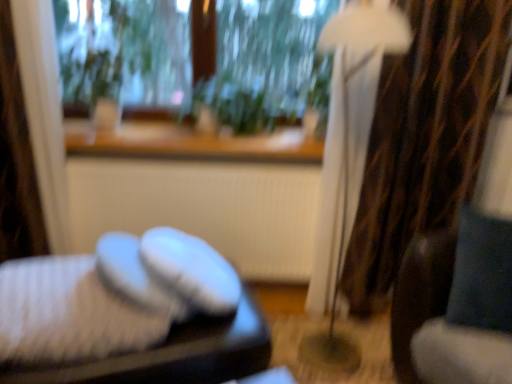
Question: Is white matte radiator at center further to the viewer compared to white knitted socks at lower left?

Choices:
 (A) no
 (B) yes

Answer: (B)

Question: Considering the relative sizes of white matte radiator at center and white knitted socks at lower left in the image provided, is white matte radiator at center smaller than white knitted socks at lower left?

Choices:
 (A) no
 (B) yes

Answer: (A)

Question: Is white matte radiator at center taller than white knitted socks at lower left?

Choices:
 (A) no
 (B) yes

Answer: (B)

Question: Can we say white matte radiator at center lies outside white knitted socks at lower left?

Choices:
 (A) no
 (B) yes

Answer: (B)

Question: From the image's perspective, is white matte radiator at center over white knitted socks at lower left?

Choices:
 (A) yes
 (B) no

Answer: (A)

Question: From a real-world perspective, is white matte radiator at center physically above white knitted socks at lower left?

Choices:
 (A) no
 (B) yes

Answer: (A)

Question: Does white knitted slippers at lower left have a smaller size compared to white fabric lampshade at right?

Choices:
 (A) no
 (B) yes

Answer: (A)

Question: Is white knitted slippers at lower left oriented away from white fabric lampshade at right?

Choices:
 (A) no
 (B) yes

Answer: (A)

Question: Can you confirm if white knitted slippers at lower left is thinner than white fabric lampshade at right?

Choices:
 (A) yes
 (B) no

Answer: (B)

Question: Is white knitted slippers at lower left in contact with white fabric lampshade at right?

Choices:
 (A) yes
 (B) no

Answer: (B)

Question: From the image's perspective, is white knitted slippers at lower left under white fabric lampshade at right?

Choices:
 (A) yes
 (B) no

Answer: (A)

Question: Can we say white knitted slippers at lower left lies outside white fabric lampshade at right?

Choices:
 (A) no
 (B) yes

Answer: (B)

Question: Is white matte radiator at center behind velvet blue swivel chair at right?

Choices:
 (A) no
 (B) yes

Answer: (B)